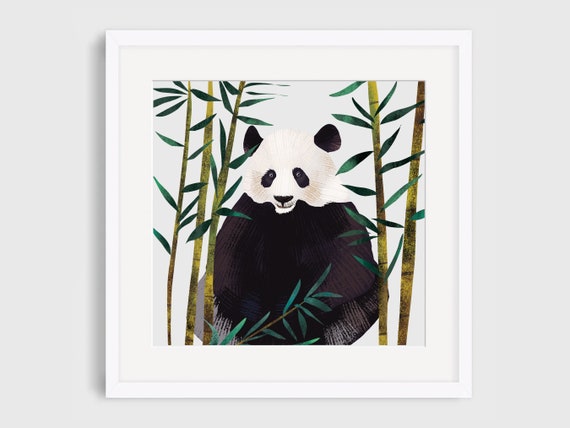
Identify the location of white matting. (123, 212).